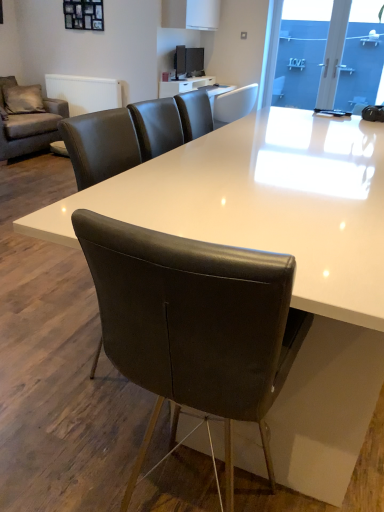
Identify the location of blue glass door at upper right. The image size is (384, 512). (301, 52).

Find the location of a particular element. The height and width of the screenshot is (512, 384). dark gray fabric couch at upper left is located at coordinates (27, 119).

Does white leather chair at upper center, acting as the second chair starting from the front, touch dark gray fabric couch at upper left?

There is a gap between white leather chair at upper center, acting as the second chair starting from the front, and dark gray fabric couch at upper left.

Can we say white leather chair at upper center, the first chair when ordered from top to bottom, lies outside dark gray fabric couch at upper left?

That's correct, white leather chair at upper center, the first chair when ordered from top to bottom, is outside of dark gray fabric couch at upper left.

Is white leather chair at upper center, the first chair viewed from the back, looking in the opposite direction of dark gray fabric couch at upper left?

No, white leather chair at upper center, the first chair viewed from the back, is not facing the opposite direction of dark gray fabric couch at upper left.

Between white leather chair at upper center, the first chair when ordered from top to bottom, and dark gray fabric couch at upper left, which one has less height?

Standing shorter between the two is white leather chair at upper center, the first chair when ordered from top to bottom.

Is leather at center, the first chair in the bottom-to-top sequence, behind dark gray fabric couch at upper left?

No, the depth of leather at center, the first chair in the bottom-to-top sequence, is less than that of dark gray fabric couch at upper left.

Is point (246, 359) behind point (5, 111)?

No, (246, 359) is closer to viewer.

Consider the image. Can you confirm if leather at center, the first chair in the bottom-to-top sequence, is wider than dark gray fabric couch at upper left?

No.

How different are the orientations of leather at center, the 1th chair positioned from the front, and dark gray fabric couch at upper left in degrees?

leather at center, the 1th chair positioned from the front, and dark gray fabric couch at upper left are facing 91.8 degrees away from each other.

Does blue glass door at upper right have a lesser width compared to white leather chair at upper center, which ranks as the 2th chair in bottom-to-top order?

Correct, the width of blue glass door at upper right is less than that of white leather chair at upper center, which ranks as the 2th chair in bottom-to-top order.

Identify the location of window screen that appears above the white leather chair at upper center, the first chair when ordered from top to bottom (from a real-world perspective). (301, 52).

Does blue glass door at upper right turn towards white leather chair at upper center, the first chair viewed from the back?

No, blue glass door at upper right does not turn towards white leather chair at upper center, the first chair viewed from the back.

Can you tell me how much blue glass door at upper right and white leather chair at upper center, the first chair viewed from the back, differ in facing direction?

90.5 degrees.

What's the angular difference between dark gray fabric couch at upper left and white leather chair at upper center, the first chair viewed from the back,'s facing directions?

177 degrees separate the facing orientations of dark gray fabric couch at upper left and white leather chair at upper center, the first chair viewed from the back.

Between dark gray fabric couch at upper left and white leather chair at upper center, the first chair viewed from the back, which one is positioned behind?

Positioned behind is white leather chair at upper center, the first chair viewed from the back.

From a real-world perspective, which is physically above, dark gray fabric couch at upper left or white leather chair at upper center, the first chair viewed from the back?

From a 3D spatial view, white leather chair at upper center, the first chair viewed from the back, is above.

Can white leather chair at upper center, the first chair viewed from the back, be found inside dark gray fabric couch at upper left?

Actually, white leather chair at upper center, the first chair viewed from the back, is outside dark gray fabric couch at upper left.

Which object is further away from the camera, blue glass door at upper right or leather at center, the 1th chair positioned from the front?

blue glass door at upper right is further away from the camera.

From the image's perspective, would you say blue glass door at upper right is shown under leather at center, the 1th chair positioned from the front?

Actually, blue glass door at upper right appears above leather at center, the 1th chair positioned from the front, in the image.

Is blue glass door at upper right turned away from leather at center, the 1th chair positioned from the front?

blue glass door at upper right does not have its back to leather at center, the 1th chair positioned from the front.

I want to click on glass door located above the white leather chair at upper center, the first chair viewed from the back (from a real-world perspective), so click(361, 58).

Looking at this image, from the image's perspective, who appears lower, transparent glass door at upper right or white leather chair at upper center, the first chair viewed from the back?

From the image's view, white leather chair at upper center, the first chair viewed from the back, is below.

Considering the sizes of objects transparent glass door at upper right and white leather chair at upper center, which ranks as the 2th chair in bottom-to-top order, in the image provided, who is taller, transparent glass door at upper right or white leather chair at upper center, which ranks as the 2th chair in bottom-to-top order,?

transparent glass door at upper right is taller.

Is point (372, 13) farther from viewer compared to point (253, 96)?

That is False.

Are dark gray fabric couch at upper left and blue glass door at upper right making contact?

No, dark gray fabric couch at upper left is not with blue glass door at upper right.

Is dark gray fabric couch at upper left further to the viewer compared to blue glass door at upper right?

No, dark gray fabric couch at upper left is in front of blue glass door at upper right.

Between dark gray fabric couch at upper left and blue glass door at upper right, which one has smaller width?

blue glass door at upper right is thinner.

In order to click on studio couch located underneath the white leather chair at upper center, the first chair viewed from the back (from a real-world perspective) in this screenshot , I will do `click(27, 119)`.

This screenshot has width=384, height=512. I want to click on chair in front of the dark gray fabric couch at upper left, so click(x=193, y=324).

From the image, which object appears to be farther from white leather chair at upper center, acting as the second chair starting from the front, leather at center, acting as the 2th chair starting from the back, or dark gray fabric couch at upper left?

Based on the image, dark gray fabric couch at upper left appears to be further to white leather chair at upper center, acting as the second chair starting from the front.

Considering their positions, is transparent glass door at upper right positioned further to dark gray fabric couch at upper left than white leather chair at upper center, the first chair when ordered from top to bottom?

transparent glass door at upper right.

Which object lies nearer to the anchor point leather at center, acting as the 2th chair starting from the back, transparent glass door at upper right or white leather chair at upper center, acting as the second chair starting from the front?

The object closer to leather at center, acting as the 2th chair starting from the back, is white leather chair at upper center, acting as the second chair starting from the front.

When comparing their distances from white leather chair at upper center, acting as the second chair starting from the front, does blue glass door at upper right or dark gray fabric couch at upper left seem further?

Among the two, dark gray fabric couch at upper left is located further to white leather chair at upper center, acting as the second chair starting from the front.

Considering their positions, is leather at center, the 1th chair positioned from the front, positioned closer to blue glass door at upper right than white leather chair at upper center, the first chair viewed from the back?

white leather chair at upper center, the first chair viewed from the back.

Looking at the image, which one is located closer to blue glass door at upper right, white leather chair at upper center, acting as the second chair starting from the front, or transparent glass door at upper right?

transparent glass door at upper right is positioned closer to the anchor blue glass door at upper right.

Looking at this image, which object lies nearer to the anchor point leather at center, which appears as the second chair when viewed from the top, dark gray fabric couch at upper left or white leather chair at upper center, which ranks as the 2th chair in bottom-to-top order?

white leather chair at upper center, which ranks as the 2th chair in bottom-to-top order, lies closer to leather at center, which appears as the second chair when viewed from the top, than the other object.

Considering their positions, is transparent glass door at upper right positioned further to dark gray fabric couch at upper left than leather at center, which appears as the second chair when viewed from the top?

Among the two, leather at center, which appears as the second chair when viewed from the top, is located further to dark gray fabric couch at upper left.

Where is `studio couch positioned between leather at center, the 1th chair positioned from the front, and white leather chair at upper center, the first chair viewed from the back, from near to far`? This screenshot has width=384, height=512. studio couch positioned between leather at center, the 1th chair positioned from the front, and white leather chair at upper center, the first chair viewed from the back, from near to far is located at coordinates pos(27,119).

Locate an element on the screen. The height and width of the screenshot is (512, 384). window screen between dark gray fabric couch at upper left and transparent glass door at upper right in the horizontal direction is located at coordinates [301, 52].

At what (x,y) coordinates should I click in order to perform the action: click on glass door between leather at center, the first chair in the bottom-to-top sequence, and white leather chair at upper center, the first chair viewed from the back, in the front-back direction. Please return your answer as a coordinate pair (x, y). Looking at the image, I should click on (361, 58).

The height and width of the screenshot is (512, 384). In order to click on window screen between leather at center, which appears as the second chair when viewed from the top, and white leather chair at upper center, the first chair viewed from the back, along the z-axis in this screenshot , I will do `click(301, 52)`.